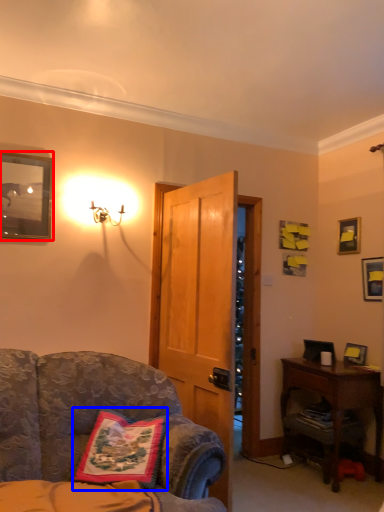
Question: Which point is closer to the camera, picture frame (highlighted by a red box) or pillow (highlighted by a blue box)?

Choices:
 (A) picture frame
 (B) pillow

Answer: (B)